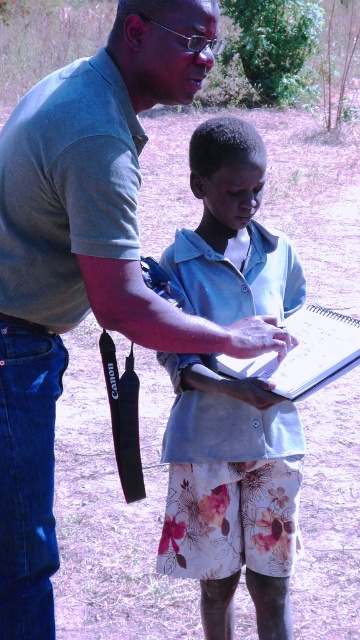
Can you confirm if light blue fabric shirt at center is wider than white paper clipboard at center?

Indeed, light blue fabric shirt at center has a greater width compared to white paper clipboard at center.

Who is taller, light blue fabric shirt at center or white paper clipboard at center?

light blue fabric shirt at center is taller.

Between point (191, 572) and point (315, 323), which one is positioned in front?

Positioned in front is point (315, 323).

Locate an element on the screen. The width and height of the screenshot is (360, 640). light blue fabric shirt at center is located at coordinates (231, 492).